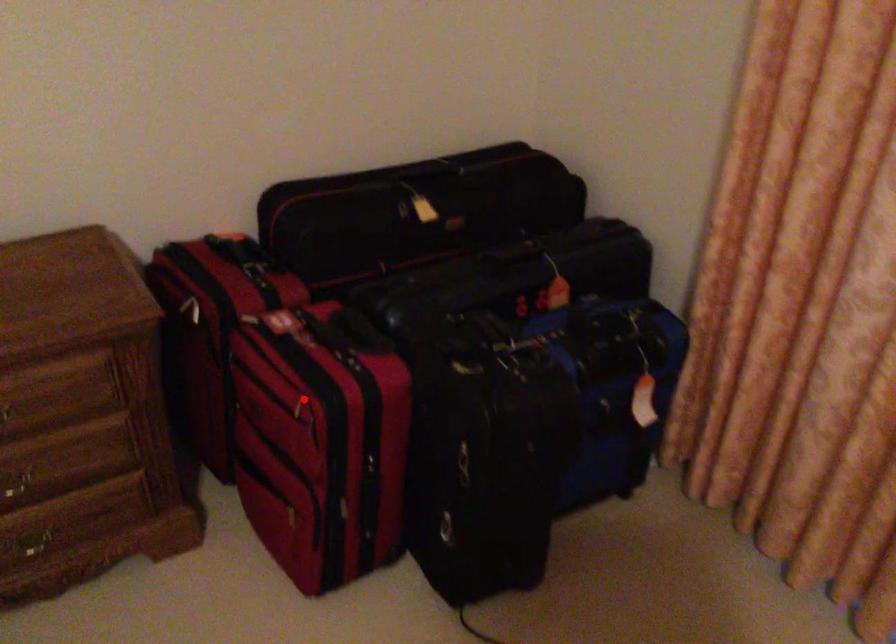
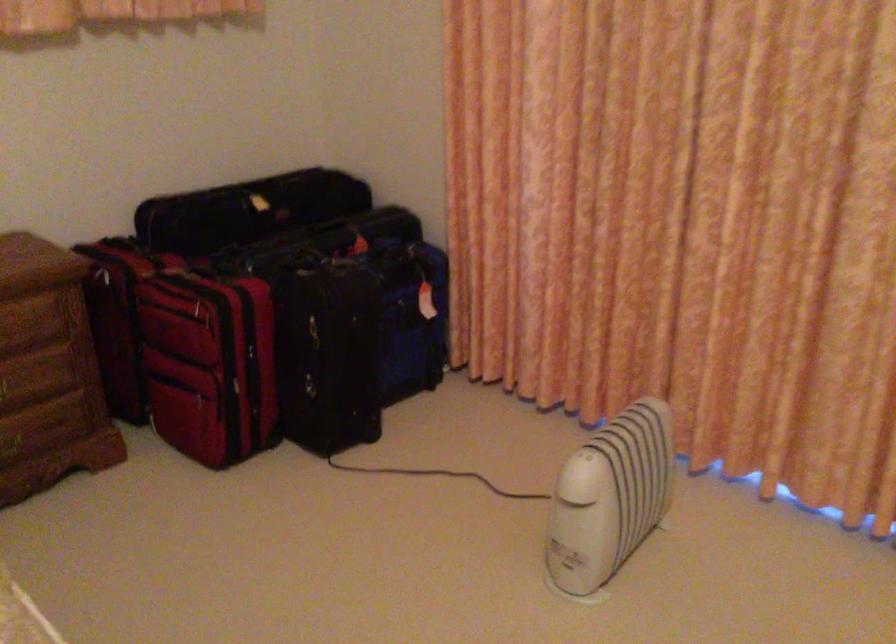
Question: I am providing you with two images of the same scene from different viewpoints. A red point is marked on the first image. Is the red point's position out of view in image 2?

Choices:
 (A) Yes
 (B) No

Answer: (B)